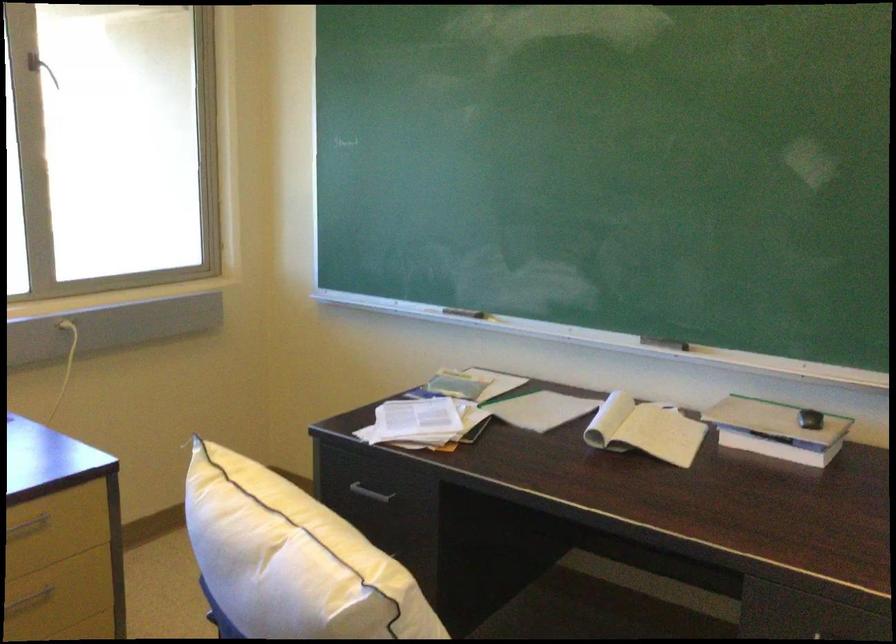
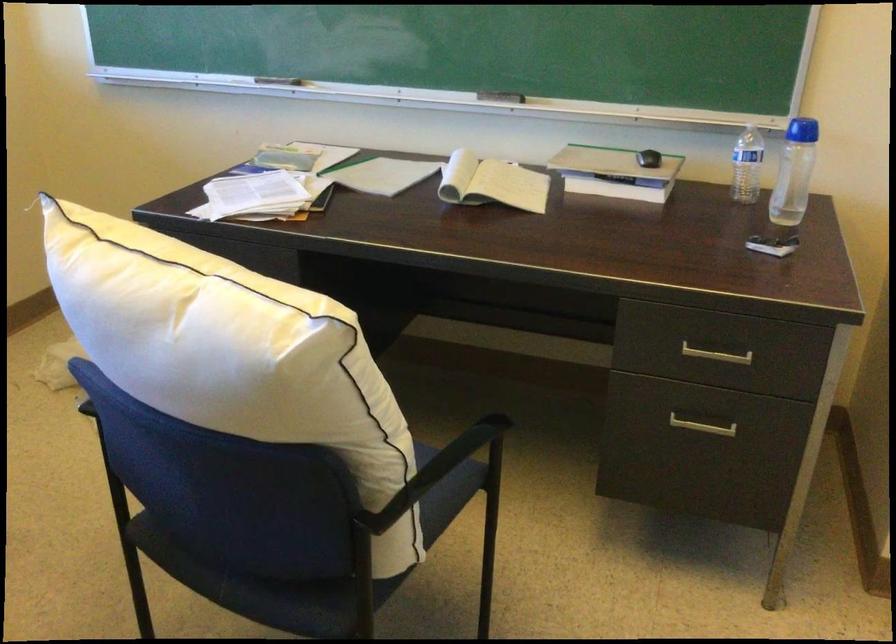
What movement of the cameraman would produce the second image?

The movement direction of the cameraman is left, forward.